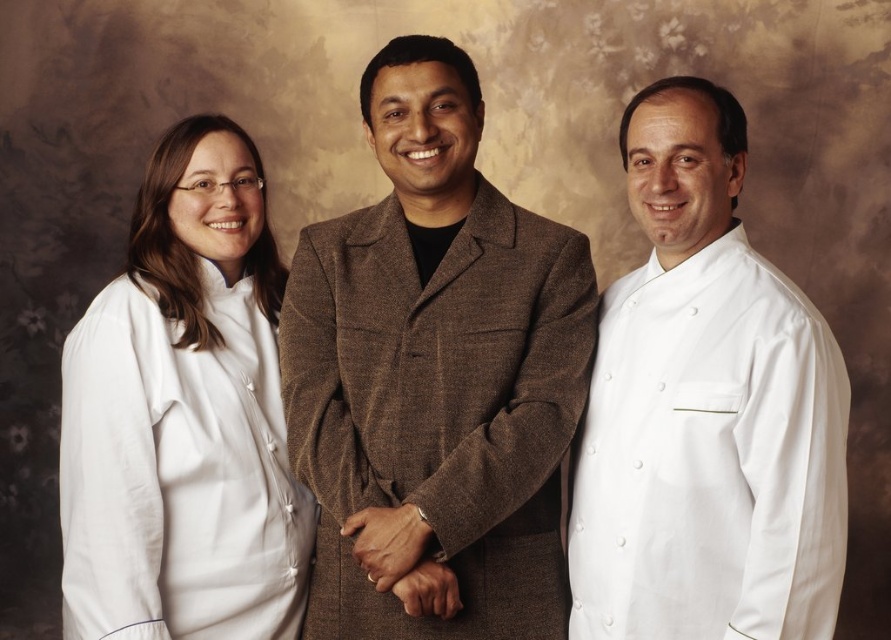
Consider the image. Who is positioned more to the right, brown woolen suit at center or white smooth chef coat at right?

white smooth chef coat at right is more to the right.

Which of these two, brown woolen suit at center or white smooth chef coat at right, stands shorter?

white smooth chef coat at right is shorter.

Is point (413, 432) closer to viewer compared to point (616, 620)?

No.

Identify the location of brown woolen suit at center. The width and height of the screenshot is (891, 640). (434, 378).

You are a GUI agent. You are given a task and a screenshot of the screen. Output one action in this format:
    pyautogui.click(x=<x>, y=<y>)
    Task: Click on the brown woolen suit at center
    Image resolution: width=891 pixels, height=640 pixels.
    Given the screenshot: What is the action you would take?
    pyautogui.click(x=434, y=378)

Based on the photo, between brown woolen suit at center and white fabric at left, which one is positioned lower?

white fabric at left is below.

Is point (432, 616) in front of point (67, 426)?

Yes, point (432, 616) is closer to viewer.

Where is `brown woolen suit at center`? brown woolen suit at center is located at coordinates (434, 378).

Can you confirm if white smooth chef coat at right is bigger than white fabric at left?

Actually, white smooth chef coat at right might be smaller than white fabric at left.

Is the position of white smooth chef coat at right less distant than that of white fabric at left?

Yes, it is in front of white fabric at left.

Which is behind, point (666, 460) or point (153, 536)?

Positioned behind is point (153, 536).

I want to click on white smooth chef coat at right, so click(x=705, y=410).